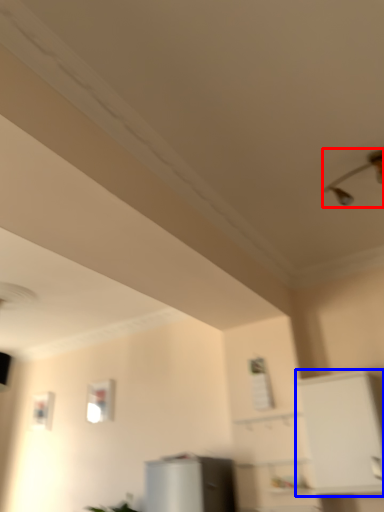
Question: Which point is closer to the camera, light fixture (highlighted by a red box) or cabinetry (highlighted by a blue box)?

Choices:
 (A) light fixture
 (B) cabinetry

Answer: (A)